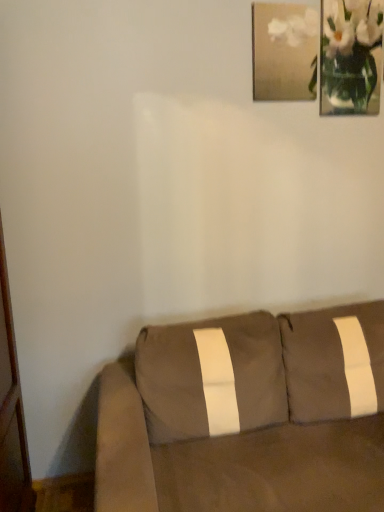
Question: Is white glass vase at upper right at the right side of matte gold picture frame at upper right?

Choices:
 (A) yes
 (B) no

Answer: (A)

Question: Is white glass vase at upper right not near matte gold picture frame at upper right?

Choices:
 (A) no
 (B) yes

Answer: (A)

Question: From the image's perspective, does white glass vase at upper right appear higher than matte gold picture frame at upper right?

Choices:
 (A) no
 (B) yes

Answer: (B)

Question: Is white glass vase at upper right smaller than matte gold picture frame at upper right?

Choices:
 (A) yes
 (B) no

Answer: (B)

Question: From a real-world perspective, is white glass vase at upper right positioned under matte gold picture frame at upper right based on gravity?

Choices:
 (A) no
 (B) yes

Answer: (B)

Question: Is matte gold picture frame at upper right bigger or smaller than suede brown couch at lower right?

Choices:
 (A) small
 (B) big

Answer: (A)

Question: In the image, is matte gold picture frame at upper right on the left side or the right side of suede brown couch at lower right?

Choices:
 (A) right
 (B) left

Answer: (A)

Question: Is matte gold picture frame at upper right inside the boundaries of suede brown couch at lower right, or outside?

Choices:
 (A) outside
 (B) inside

Answer: (A)

Question: From the image's perspective, is matte gold picture frame at upper right positioned above or below suede brown couch at lower right?

Choices:
 (A) above
 (B) below

Answer: (A)

Question: Looking at their shapes, would you say matte gold picture frame at upper right is wider or thinner than white glass vase at upper right?

Choices:
 (A) thin
 (B) wide

Answer: (B)

Question: From the image's perspective, is matte gold picture frame at upper right located above or below white glass vase at upper right?

Choices:
 (A) above
 (B) below

Answer: (B)

Question: Would you say matte gold picture frame at upper right is to the left or to the right of white glass vase at upper right in the picture?

Choices:
 (A) left
 (B) right

Answer: (A)

Question: Is matte gold picture frame at upper right inside or outside of white glass vase at upper right?

Choices:
 (A) outside
 (B) inside

Answer: (A)

Question: Is point (200, 338) positioned closer to the camera than point (279, 51)?

Choices:
 (A) farther
 (B) closer

Answer: (B)

Question: Is suede brown couch at lower right to the left or to the right of matte gold picture frame at upper right in the image?

Choices:
 (A) right
 (B) left

Answer: (B)